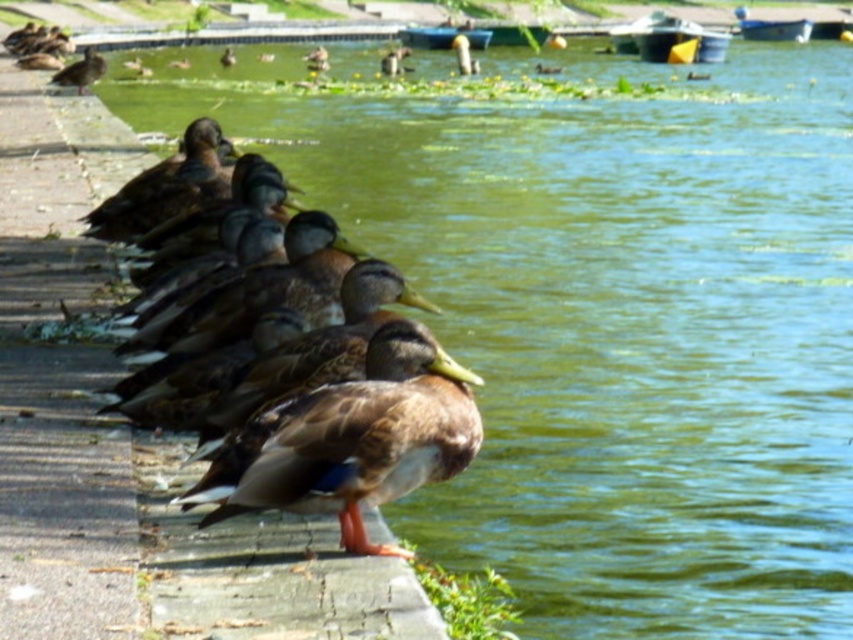
Question: Which of these objects is positioned closest to the brown feathered mallard duck at left?

Choices:
 (A) brown matte duck at left
 (B) brown matte duck at upper left

Answer: (A)

Question: Considering the real-world distances, which object is closest to the brown feathered mallard duck at left?

Choices:
 (A) brown matte duck at left
 (B) brown matte duck at upper left

Answer: (A)

Question: Which object is positioned closest to the brown matte duck at left?

Choices:
 (A) brown feathered mallard duck at left
 (B) brown matte duck at upper left

Answer: (A)

Question: Is brown feathered mallard duck at left closer to camera compared to brown matte duck at upper left?

Choices:
 (A) yes
 (B) no

Answer: (A)

Question: Does brown feathered mallard duck at left have a larger size compared to brown matte duck at upper left?

Choices:
 (A) no
 (B) yes

Answer: (B)

Question: Is brown feathered mallard duck at left closer to camera compared to brown matte duck at upper left?

Choices:
 (A) no
 (B) yes

Answer: (B)